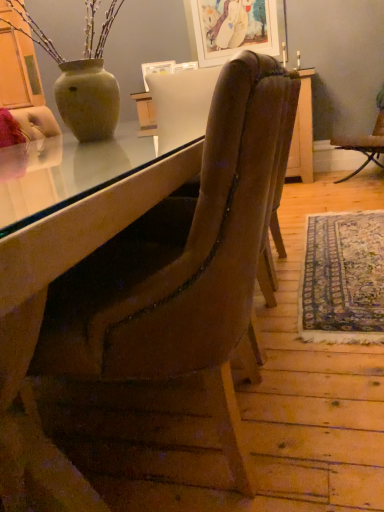
Question: Would you say blue patterned rug at lower right is to the left or to the right of velvet brown chair at center, which is the first chair in left-to-right order, in the picture?

Choices:
 (A) left
 (B) right

Answer: (B)

Question: Is point (372, 336) closer or farther from the camera than point (134, 266)?

Choices:
 (A) farther
 (B) closer

Answer: (A)

Question: Which is farther from the velvet brown chair at center, which appears as the first chair when ordered from the bottom?

Choices:
 (A) brown leather chair at right, arranged as the 1th chair when viewed from the top
 (B) blue patterned rug at lower right
 (C) matte white picture frame at upper center

Answer: (C)

Question: Which object is the farthest from the brown leather chair at right, the first chair positioned from the right?

Choices:
 (A) matte white picture frame at upper center
 (B) blue patterned rug at lower right
 (C) velvet brown chair at center, which ranks as the first chair in front-to-back order

Answer: (C)